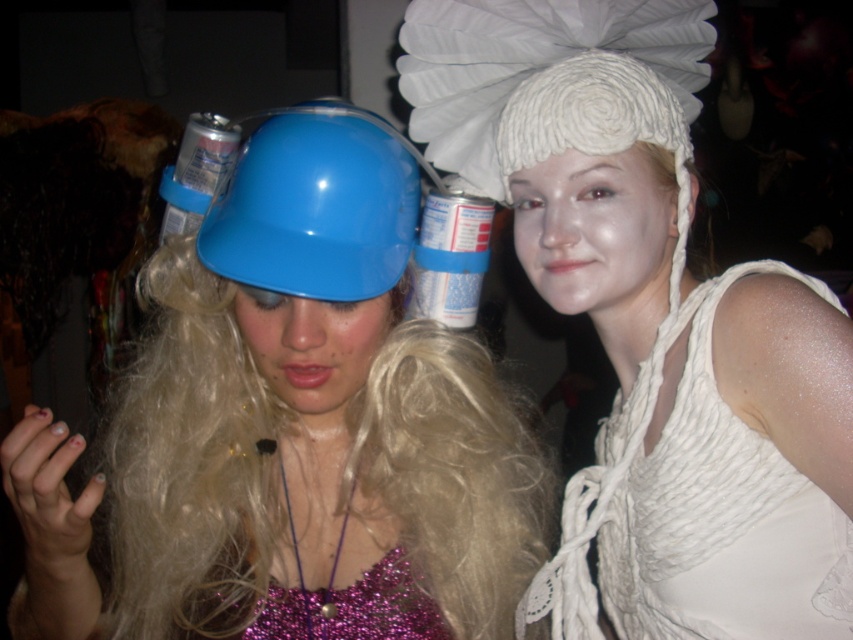
Question: Among these points, which one is farthest from the camera?

Choices:
 (A) (213, 234)
 (B) (352, 134)
 (C) (729, 580)

Answer: (C)

Question: Which of the following is the closest to the observer?

Choices:
 (A) (335, 572)
 (B) (643, 355)
 (C) (618, 460)
 (D) (363, 243)

Answer: (D)

Question: Estimate the real-world distances between objects in this image. Which object is closer to the matte plastic helmet at center?

Choices:
 (A) white knitted dress at upper right
 (B) white knitted hat at upper center

Answer: (B)

Question: Is matte plastic helmet at center further to the viewer compared to blue glossy helmet at center?

Choices:
 (A) no
 (B) yes

Answer: (A)

Question: Can you confirm if matte plastic helmet at center is bigger than white knitted dress at upper right?

Choices:
 (A) yes
 (B) no

Answer: (A)

Question: Where is matte plastic helmet at center located in relation to white knitted dress at upper right in the image?

Choices:
 (A) above
 (B) below

Answer: (B)